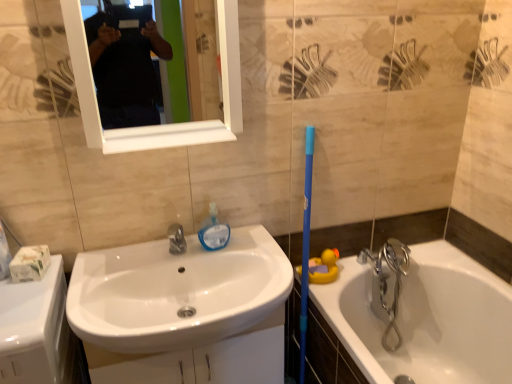
Question: From a real-world perspective, is translucent plastic soap dispenser at center under white glossy counter top at lower left?

Choices:
 (A) yes
 (B) no

Answer: (B)

Question: Is translucent plastic soap dispenser at center shorter than white glossy counter top at lower left?

Choices:
 (A) yes
 (B) no

Answer: (B)

Question: From the image's perspective, is translucent plastic soap dispenser at center beneath white glossy counter top at lower left?

Choices:
 (A) no
 (B) yes

Answer: (A)

Question: Is translucent plastic soap dispenser at center outside of white glossy counter top at lower left?

Choices:
 (A) no
 (B) yes

Answer: (B)

Question: From the image's perspective, would you say translucent plastic soap dispenser at center is positioned over white glossy counter top at lower left?

Choices:
 (A) yes
 (B) no

Answer: (A)

Question: Is white glossy bathtub at right in front of or behind chrome metallic faucet at right in the image?

Choices:
 (A) front
 (B) behind

Answer: (A)

Question: Which is correct: white glossy bathtub at right is inside chrome metallic faucet at right, or outside of it?

Choices:
 (A) inside
 (B) outside

Answer: (B)

Question: In terms of height, does white glossy bathtub at right look taller or shorter compared to chrome metallic faucet at right?

Choices:
 (A) short
 (B) tall

Answer: (B)

Question: Based on their positions, is white glossy bathtub at right located to the left or right of chrome metallic faucet at right?

Choices:
 (A) left
 (B) right

Answer: (B)

Question: Is white glossy mirror at upper center wider or thinner than yellow rubber duck at lower right?

Choices:
 (A) thin
 (B) wide

Answer: (B)

Question: In terms of height, does white glossy mirror at upper center look taller or shorter compared to yellow rubber duck at lower right?

Choices:
 (A) tall
 (B) short

Answer: (A)

Question: Considering the positions of white glossy mirror at upper center and yellow rubber duck at lower right in the image, is white glossy mirror at upper center bigger or smaller than yellow rubber duck at lower right?

Choices:
 (A) small
 (B) big

Answer: (B)

Question: In the image, is white glossy mirror at upper center on the left side or the right side of yellow rubber duck at lower right?

Choices:
 (A) left
 (B) right

Answer: (A)

Question: Considering the positions of point (111, 266) and point (53, 377), is point (111, 266) closer or farther from the camera than point (53, 377)?

Choices:
 (A) farther
 (B) closer

Answer: (A)

Question: From the image's perspective, is white glossy sink at center located above or below white glossy counter top at lower left?

Choices:
 (A) below
 (B) above

Answer: (B)